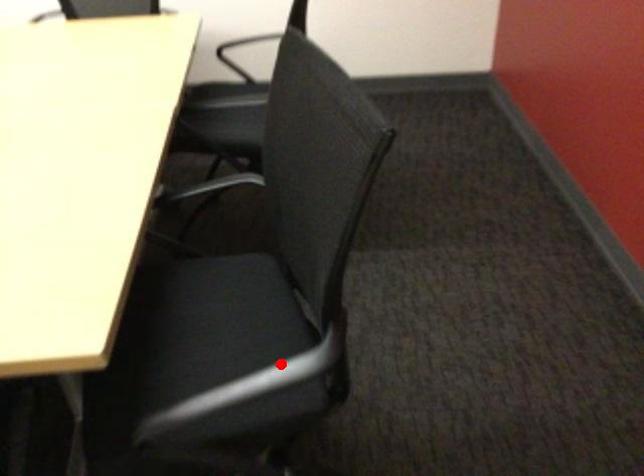
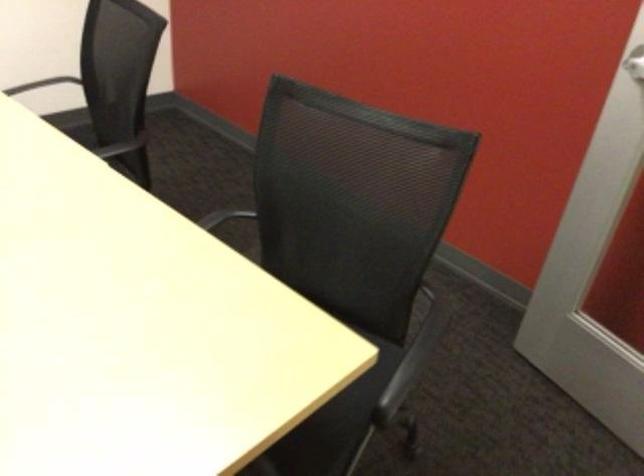
Question: I am providing you with two images of the same scene from different viewpoints. In image1, a red point is highlighted. Considering the same 3D point in image2, which of the following is correct?

Choices:
 (A) It is closer
 (B) It is farther

Answer: (B)